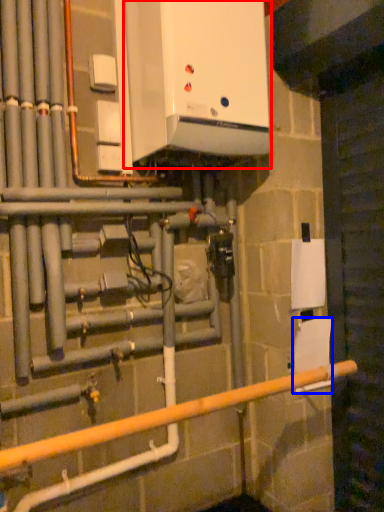
Question: Which point is further to the camera, home appliance (highlighted by a red box) or toilet paper (highlighted by a blue box)?

Choices:
 (A) home appliance
 (B) toilet paper

Answer: (B)